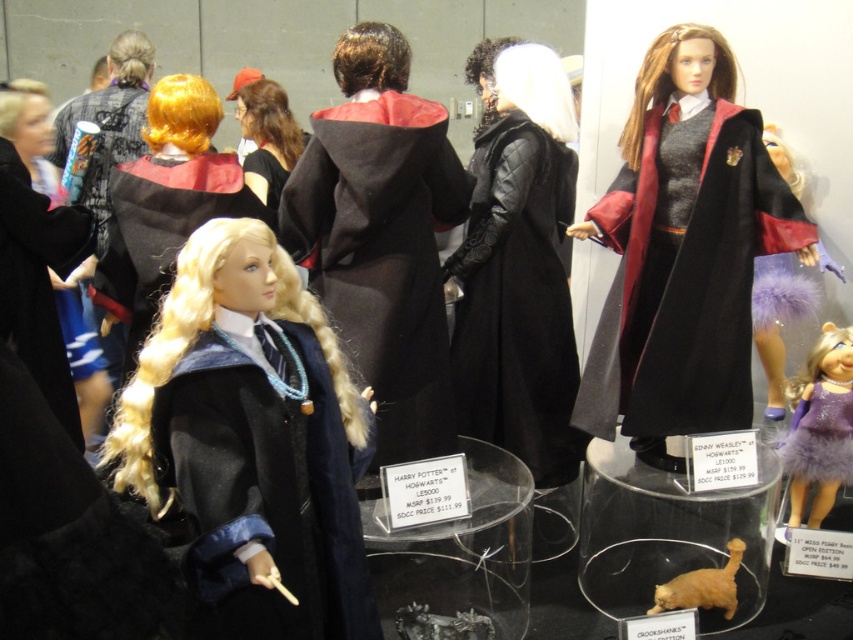
Can you confirm if matte black robe at center is wider than golden fur cat at lower center?

Yes.

Between matte black robe at center and golden fur cat at lower center, which one appears on the left side from the viewer's perspective?

Positioned to the left is matte black robe at center.

Locate an element on the screen. matte black robe at center is located at coordinates (251, 438).

Does velvet maroon cape at right have a lesser width compared to velvet purple dress at right?

Incorrect, velvet maroon cape at right's width is not less than velvet purple dress at right's.

Between point (625, 230) and point (757, 280), which one is positioned behind?

Point (757, 280)

Who is more forward, (721, 248) or (787, 177)?

A: Point (721, 248) is in front.

Identify the location of velvet maroon cape at right. (683, 252).

Between dark gray woolen robe at center and purple furry dress at lower right, which one appears on the right side from the viewer's perspective?

Positioned to the right is purple furry dress at lower right.

Is dark gray woolen robe at center to the left of purple furry dress at lower right from the viewer's perspective?

Correct, you'll find dark gray woolen robe at center to the left of purple furry dress at lower right.

Does point (339, 317) lie behind point (840, 435)?

No, (339, 317) is in front of (840, 435).

Where is `dark gray woolen robe at center`? This screenshot has width=853, height=640. dark gray woolen robe at center is located at coordinates (381, 256).